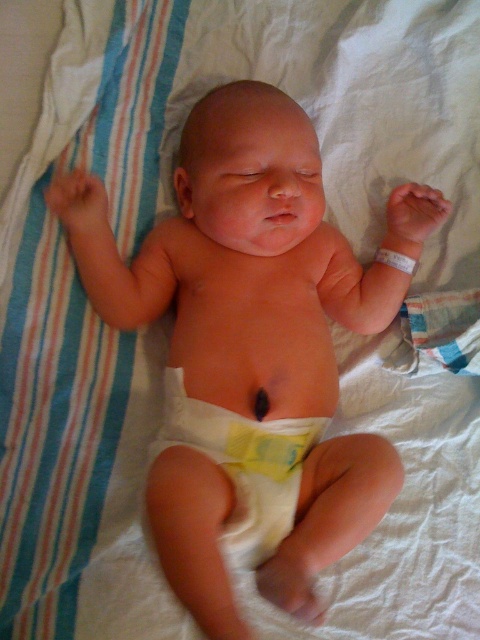
What do you see at coordinates (252, 352) in the screenshot? I see `smooth skin baby at center` at bounding box center [252, 352].

Between point (223, 211) and point (288, 426), which one is positioned behind?

The point (223, 211) is more distant.

The width and height of the screenshot is (480, 640). I want to click on smooth skin baby at center, so click(252, 352).